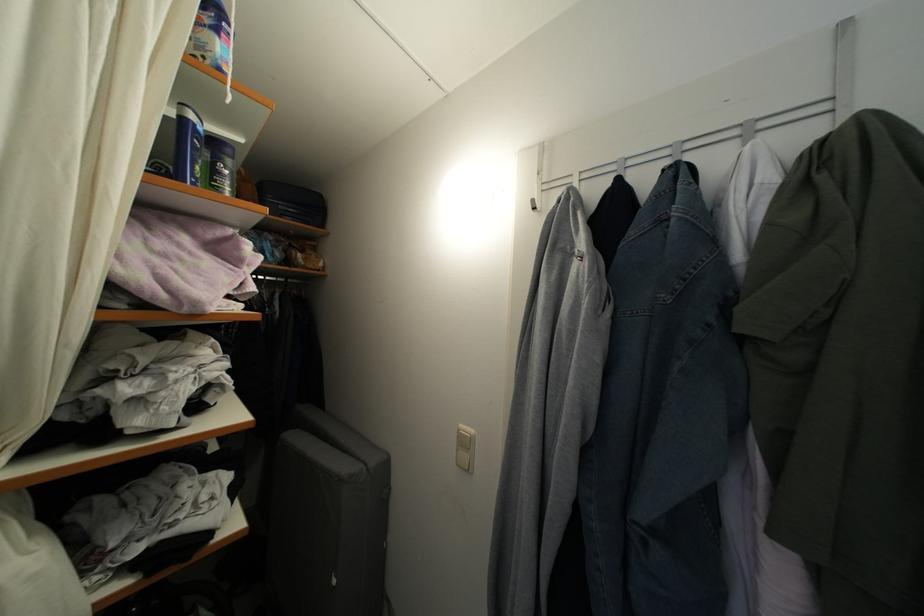
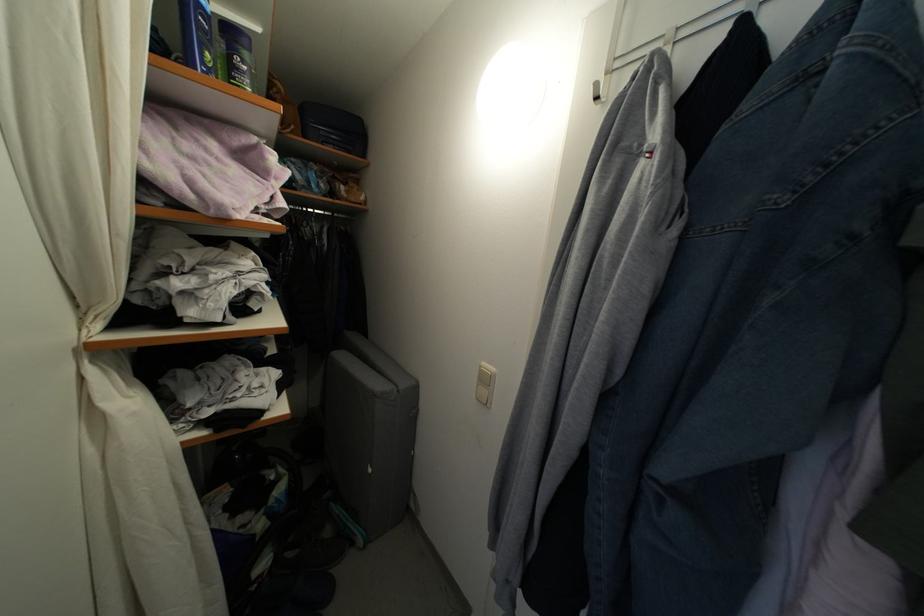
What movement of the cameraman would produce the second image?

The movement direction of the cameraman is right, forward.